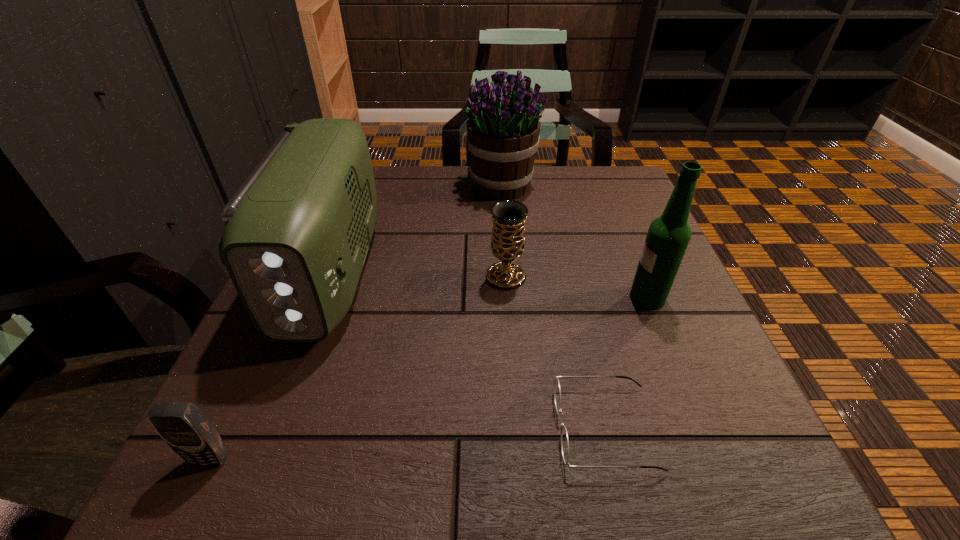
Locate an element on the screen. The height and width of the screenshot is (540, 960). vacant space at the far left corner of the desktop is located at coordinates (386, 168).

Where is `vacant region at the far right corner of the desktop`? vacant region at the far right corner of the desktop is located at coordinates (596, 197).

Find the location of a particular element. The height and width of the screenshot is (540, 960). vacant space at the near right corner is located at coordinates (746, 469).

The image size is (960, 540). In order to click on free space that is in between the radio_receiver and the rightmost object in this screenshot , I will do `click(489, 285)`.

In order to click on blank region between the bouquet and the radio_receiver in this screenshot , I will do `click(417, 228)`.

Identify the location of vacant point located between the cellular telephone and the chalice. point(358,368).

Locate an element on the screen. This screenshot has height=540, width=960. blank region between the fifth tallest object and the fourth tallest object is located at coordinates (358, 368).

I want to click on vacant area that lies between the bouquet and the radio_receiver, so click(x=417, y=228).

The height and width of the screenshot is (540, 960). I want to click on free point between the shortest object and the radio_receiver, so click(x=468, y=350).

Where is `vacant area between the rightmost object and the farthest object`? vacant area between the rightmost object and the farthest object is located at coordinates (575, 242).